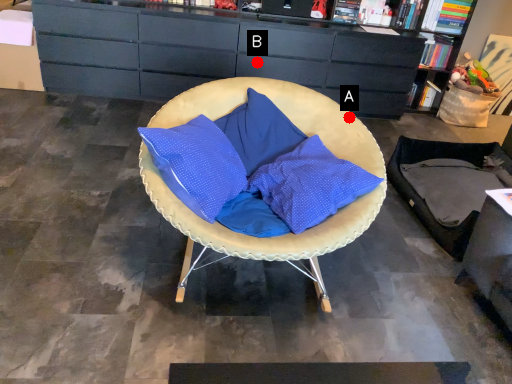
Question: Two points are circled on the image, labeled by A and B beside each circle. Which of the following is the closest to the observer?

Choices:
 (A) A is closer
 (B) B is closer

Answer: (A)